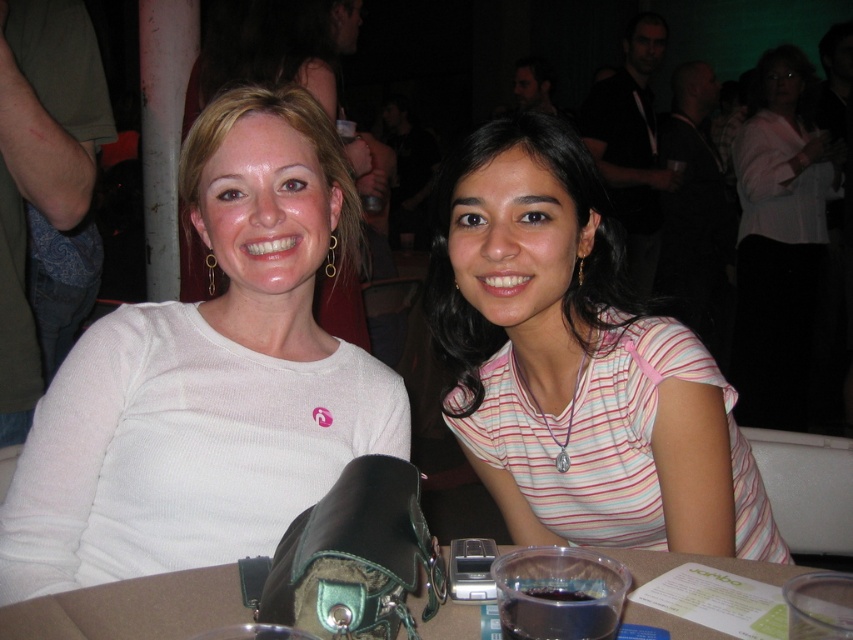
Is white matte sweater at center to the right of pink fabric shirt at center from the viewer's perspective?

In fact, white matte sweater at center is to the left of pink fabric shirt at center.

Between white matte sweater at center and pink fabric shirt at center, which one is positioned lower?

white matte sweater at center

The image size is (853, 640). In order to click on white matte sweater at center in this screenshot , I will do `click(207, 378)`.

Which of these two, white matte sweater at center or brown leather table at center, stands taller?

Standing taller between the two is white matte sweater at center.

Who is more distant from viewer, (219, 548) or (231, 577)?

The point (219, 548) is more distant.

Identify the location of white matte sweater at center. This screenshot has height=640, width=853. (207, 378).

Is pink striped shirt at center below pink fabric shirt at center?

Correct, pink striped shirt at center is located below pink fabric shirt at center.

Does pink striped shirt at center lie behind pink fabric shirt at center?

No, it is not.

Between point (537, 278) and point (775, 349), which one is positioned in front?

Point (537, 278) is more forward.

Where is `pink striped shirt at center`? The height and width of the screenshot is (640, 853). pink striped shirt at center is located at coordinates (577, 364).